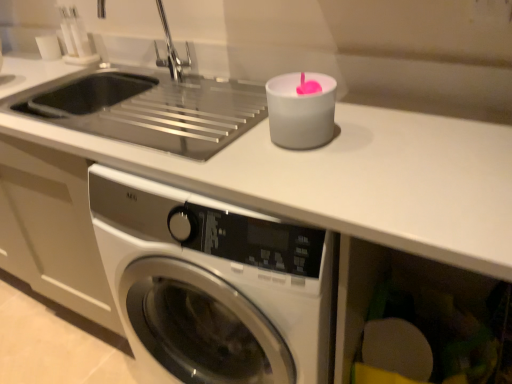
Question: Can you confirm if white matte counter top at upper center is smaller than silver metallic faucet at upper left?

Choices:
 (A) no
 (B) yes

Answer: (A)

Question: Is white matte counter top at upper center surrounding silver metallic faucet at upper left?

Choices:
 (A) no
 (B) yes

Answer: (A)

Question: From a real-world perspective, is white matte counter top at upper center positioned under silver metallic faucet at upper left based on gravity?

Choices:
 (A) no
 (B) yes

Answer: (B)

Question: From the image's perspective, is white matte counter top at upper center over silver metallic faucet at upper left?

Choices:
 (A) no
 (B) yes

Answer: (A)

Question: Does white matte counter top at upper center have a greater height compared to silver metallic faucet at upper left?

Choices:
 (A) yes
 (B) no

Answer: (A)

Question: In terms of size, does silver metallic faucet at upper left appear bigger or smaller than matte plastic sponge at lower right?

Choices:
 (A) small
 (B) big

Answer: (A)

Question: In terms of height, does silver metallic faucet at upper left look taller or shorter compared to matte plastic sponge at lower right?

Choices:
 (A) short
 (B) tall

Answer: (A)

Question: Is silver metallic faucet at upper left spatially inside matte plastic sponge at lower right, or outside of it?

Choices:
 (A) outside
 (B) inside

Answer: (A)

Question: Is silver metallic faucet at upper left in front of or behind matte plastic sponge at lower right in the image?

Choices:
 (A) front
 (B) behind

Answer: (B)

Question: From the image's perspective, relative to matte plastic sponge at lower right, is white matte candle at upper right above or below?

Choices:
 (A) above
 (B) below

Answer: (A)

Question: Does point (279, 124) appear closer or farther from the camera than point (398, 314)?

Choices:
 (A) farther
 (B) closer

Answer: (B)

Question: From a real-world perspective, is white matte candle at upper right physically located above or below matte plastic sponge at lower right?

Choices:
 (A) above
 (B) below

Answer: (A)

Question: Is white matte candle at upper right situated inside matte plastic sponge at lower right or outside?

Choices:
 (A) inside
 (B) outside

Answer: (B)

Question: Considering the positions of silver metallic faucet at upper left and white matte counter top at upper center in the image, is silver metallic faucet at upper left wider or thinner than white matte counter top at upper center?

Choices:
 (A) thin
 (B) wide

Answer: (A)

Question: Considering the relative positions of silver metallic faucet at upper left and white matte counter top at upper center in the image provided, is silver metallic faucet at upper left to the left or to the right of white matte counter top at upper center?

Choices:
 (A) right
 (B) left

Answer: (B)